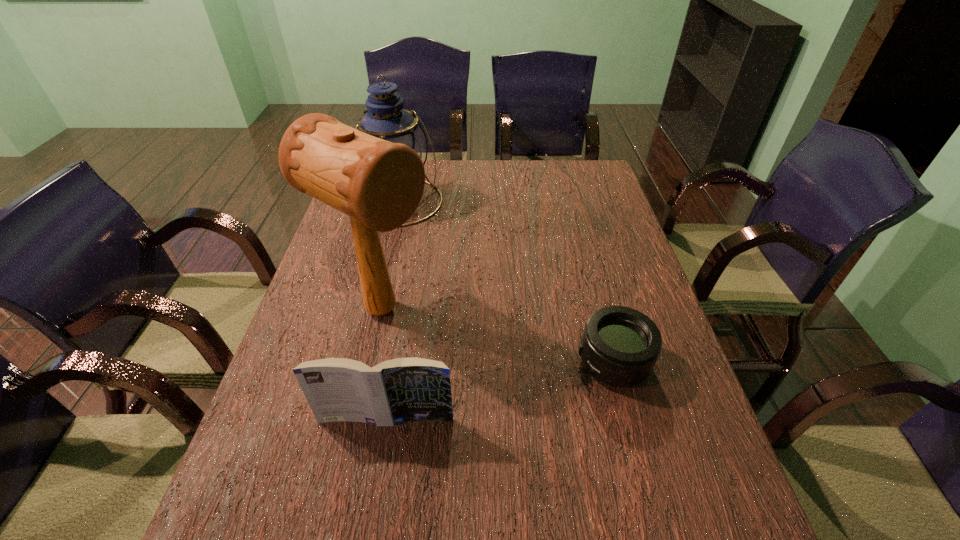
The width and height of the screenshot is (960, 540). Find the location of `free point located on the side of the shortest object with brand markings and control switches`. free point located on the side of the shortest object with brand markings and control switches is located at coordinates (493, 362).

The image size is (960, 540). What are the coordinates of `vacant point located on the front-facing side of the farthest object` in the screenshot? It's located at (432, 245).

I want to click on vacant space situated 0.120m on the front-facing side of the farthest object, so coord(432,245).

The image size is (960, 540). In order to click on free space located on the front-facing side of the farthest object in this screenshot , I will do `click(455, 275)`.

The image size is (960, 540). In order to click on vacant space located 0.380m on the strike surface of the mallet in this screenshot , I will do `click(562, 423)`.

Where is `blank area located 0.320m on the strike surface of the mallet`? This screenshot has width=960, height=540. blank area located 0.320m on the strike surface of the mallet is located at coordinates (537, 407).

The width and height of the screenshot is (960, 540). I want to click on vacant space situated on the strike surface of the mallet, so click(533, 404).

Find the location of a particular element. Image resolution: width=960 pixels, height=540 pixels. object present at the far edge is located at coordinates (386, 119).

You are a GUI agent. You are given a task and a screenshot of the screen. Output one action in this format:
    pyautogui.click(x=<x>, y=<y>)
    Task: Click on the book located at the left edge
    Image resolution: width=960 pixels, height=540 pixels.
    Given the screenshot: What is the action you would take?
    400,390

The image size is (960, 540). I want to click on lantern that is positioned at the left edge, so click(x=386, y=119).